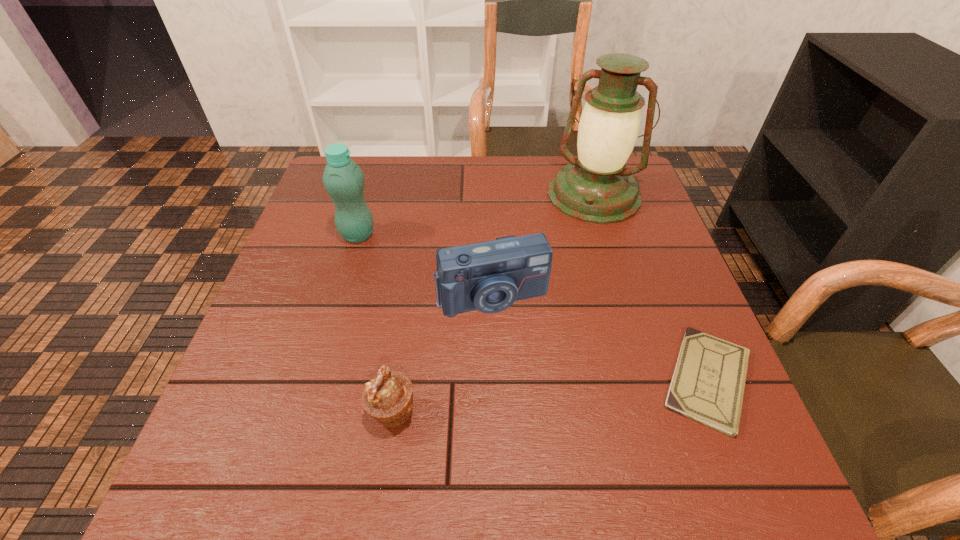
What are the coordinates of `free space at the near left corner of the desktop` in the screenshot? It's located at (228, 389).

The height and width of the screenshot is (540, 960). I want to click on free spot between the fourth shortest object and the third object from left to right, so click(x=425, y=266).

Image resolution: width=960 pixels, height=540 pixels. Identify the location of unoccupied area between the shortest object and the third object from left to right. (600, 339).

I want to click on vacant space in between the third object from right to left and the fourth shortest object, so click(425, 266).

The width and height of the screenshot is (960, 540). In order to click on vacant point located between the leftmost object and the fourth object from right to left in this screenshot , I will do `click(375, 323)`.

Find the location of `free point between the shortest object and the leftmost object`. free point between the shortest object and the leftmost object is located at coordinates (533, 307).

Image resolution: width=960 pixels, height=540 pixels. What are the coordinates of `unoccupied position between the third farthest object and the water bottle` in the screenshot? It's located at (425, 266).

You are a GUI agent. You are given a task and a screenshot of the screen. Output one action in this format:
    pyautogui.click(x=<x>, y=<y>)
    Task: Click on the vacant region between the tallest object and the leftmost object
    
    Given the screenshot: What is the action you would take?
    pyautogui.click(x=476, y=215)

Find the location of a particular element. The height and width of the screenshot is (540, 960). the fourth closest object relative to the tallest object is located at coordinates (388, 397).

Identify the location of object that stands as the second closest to the tallest object. This screenshot has height=540, width=960. (708, 383).